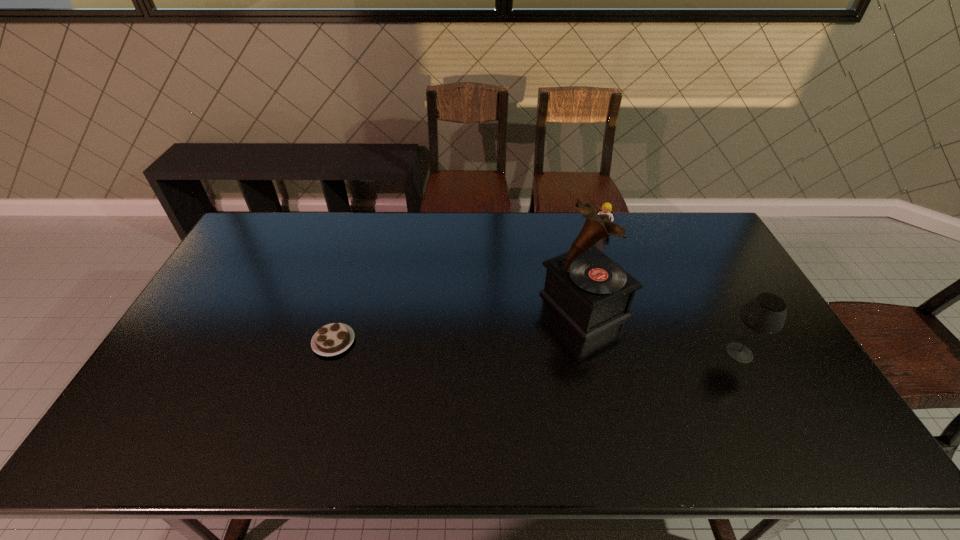
At what (x,y) coordinates should I click in order to perform the action: click on the leftmost object. Please return your answer as a coordinate pair (x, y). The width and height of the screenshot is (960, 540). Looking at the image, I should click on click(x=332, y=339).

In order to click on chocolate cake in this screenshot , I will do `click(332, 339)`.

Identify the location of wineglass. (765, 313).

Identify the location of the third shortest object. The image size is (960, 540). (765, 313).

Locate an element on the screen. the third tallest object is located at coordinates (606, 208).

Locate an element on the screen. the farthest object is located at coordinates (606, 208).

At what (x,y) coordinates should I click in order to perform the action: click on the tallest object. Please return your answer as a coordinate pair (x, y). Looking at the image, I should click on (593, 293).

Image resolution: width=960 pixels, height=540 pixels. In order to click on free space located 0.080m on the back of the leftmost object in this screenshot , I will do `click(345, 306)`.

Where is `vacant space located on the back of the rightmost object`? Image resolution: width=960 pixels, height=540 pixels. vacant space located on the back of the rightmost object is located at coordinates (725, 325).

Locate an element on the screen. This screenshot has height=540, width=960. free space located on the front-facing side of the farthest object is located at coordinates (586, 304).